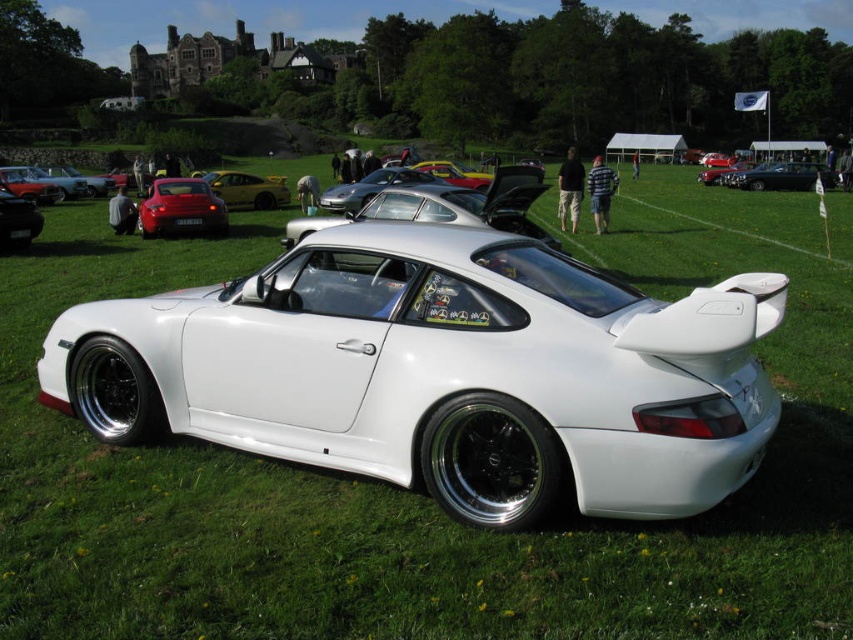
You are standing at the point labeled point (16,237) and want to walk to the point labeled point (689,324). Is there a clear path between these two points without any obstacles?

Yes, there is a clear path between point (16,237) and point (689,324) because the scene description mentions a pristine white Porsche sports car parked on a grassy field with other cars in the background, and people walking around. Since the objects description states that point (689,324) is in front of point (16,237), it implies they are along the same line of sight without obstructions. However, the scene does not mention any obstacles between them, so the path is likely clear.

You are standing in front of the white Porsche sports car at the car show. You notice two points marked on the car, one at coordinates point (363,180) and the other at point (10,237). Which point is closer to you?

Point (363,180) is further to the viewer than point (10,237), so the point closer to you is point (10,237).

You are a photographer at a car show. You need to decide whether the white glossy sports car at center will fit under a low hanging tree branch that is just tall enough for the shiny black car at left. Can it fit?

The white glossy sports car at center is taller than the shiny black car at left, so it will not fit under the tree branch that accommodates the shiny black car at left.